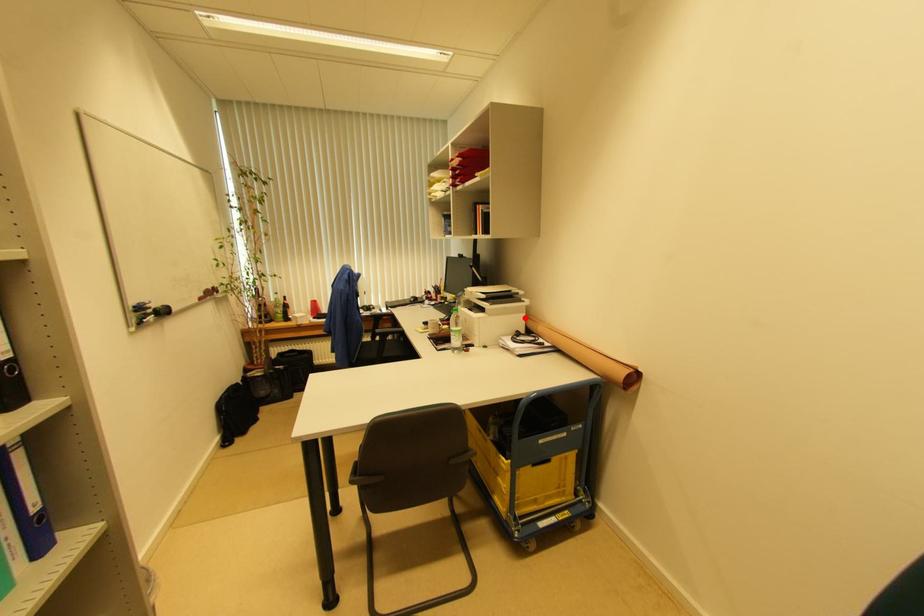
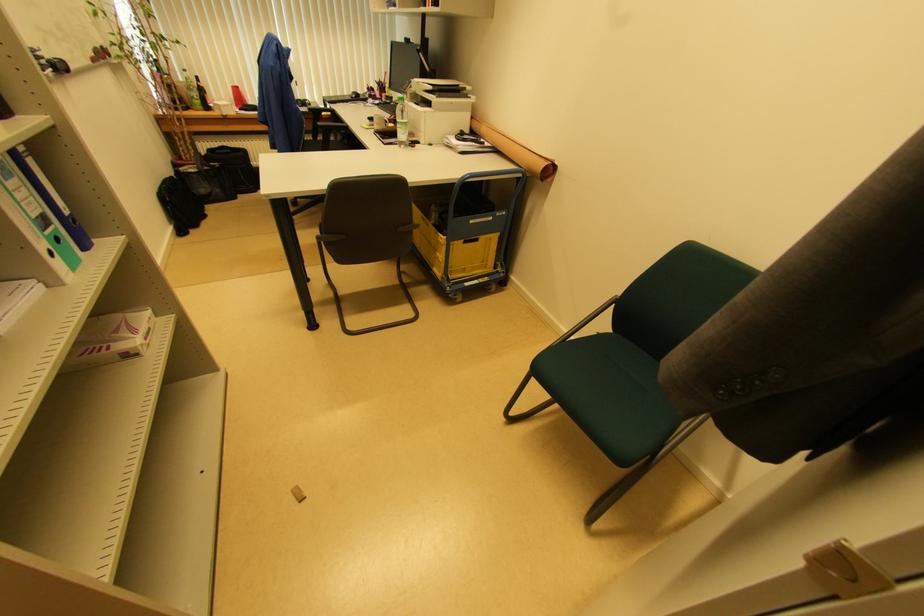
Where in the second image is the point corresponding to the highlighted location from the first image?

(469, 118)